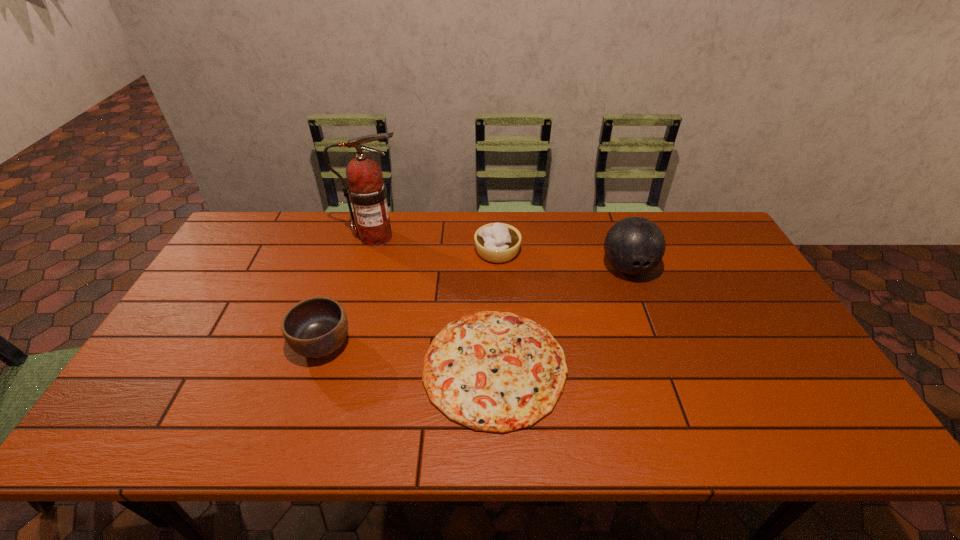
Where is `free space at the near left corner`? free space at the near left corner is located at coordinates (109, 435).

This screenshot has width=960, height=540. Identify the location of blank area at the far right corner. (699, 245).

The image size is (960, 540). In the image, there is a desktop. Identify the location of free space at the near right corner. (811, 413).

Locate an element on the screen. vacant area between the fire extinguisher and the shortest object is located at coordinates (435, 302).

Locate an element on the screen. This screenshot has height=540, width=960. free space between the second tallest object and the pizza is located at coordinates (562, 318).

Find the location of `free space that is in between the rightmost object and the whipped cream`. free space that is in between the rightmost object and the whipped cream is located at coordinates (563, 260).

Where is `free space between the shortest object and the whipped cream`? The width and height of the screenshot is (960, 540). free space between the shortest object and the whipped cream is located at coordinates (496, 309).

Image resolution: width=960 pixels, height=540 pixels. What are the coordinates of `free space between the bowl and the bowling ball` in the screenshot? It's located at click(475, 306).

This screenshot has height=540, width=960. I want to click on empty space that is in between the whipped cream and the pizza, so click(x=496, y=309).

The width and height of the screenshot is (960, 540). In order to click on free area in between the shortest object and the rightmost object in this screenshot , I will do `click(562, 318)`.